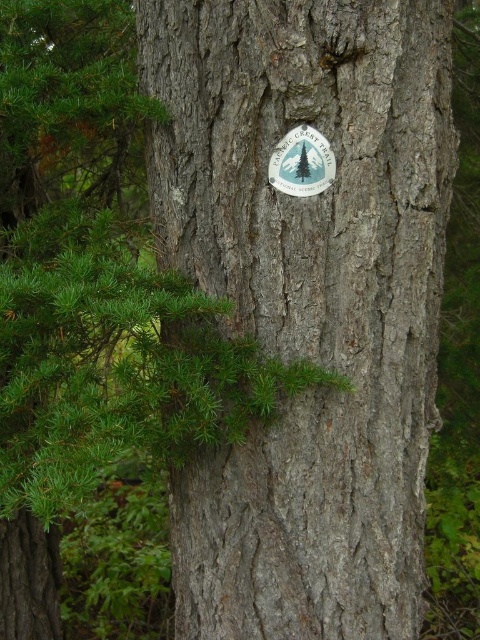
You are a hiker trying to read the trail marker sign on the tree trunk. Since the gray rough bark tree trunk at center is larger than the white matte sticker at center, will the sticker be easy to see from a distance?

The gray rough bark tree trunk at center is larger than the white matte sticker at center, so the sticker might be harder to see from a distance because it is smaller in comparison to the trunk.

You are a hiker trying to read the Pacific Crest Trail sign attached to the tree trunk. Since both the gray rough bark tree trunk at center and the white matte sticker at center are in your line of sight, which object is nearer to you?

The gray rough bark tree trunk at center is closer to the viewer than the white matte sticker at center, so the gray rough bark tree trunk at center is nearer to you.